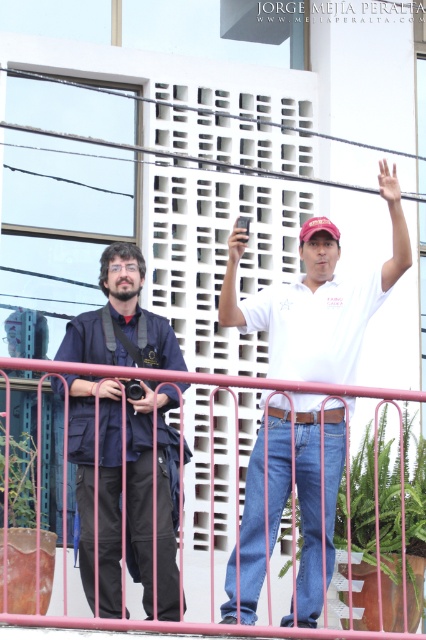
Question: Is white cotton shirt at center smaller than pink metal fence at lower center?

Choices:
 (A) yes
 (B) no

Answer: (A)

Question: Which point appears closest to the camera in this image?

Choices:
 (A) (267, 476)
 (B) (60, 381)
 (C) (129, 451)

Answer: (A)

Question: Which object is positioned farthest from the white cotton shirt at center?

Choices:
 (A) dark blue fabric jacket at left
 (B) pink metal fence at lower center

Answer: (A)

Question: Can you confirm if white cotton shirt at center is positioned above dark blue fabric jacket at left?

Choices:
 (A) no
 (B) yes

Answer: (A)

Question: Can you confirm if white cotton shirt at center is positioned below pink metal fence at lower center?

Choices:
 (A) no
 (B) yes

Answer: (A)

Question: Which point is farther to the camera?

Choices:
 (A) (129, 602)
 (B) (325, 257)

Answer: (A)